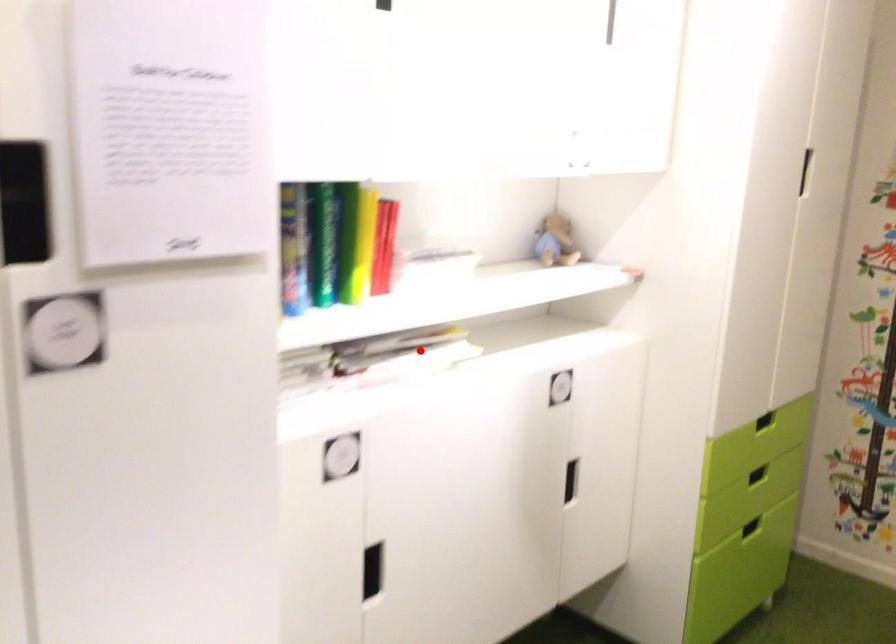
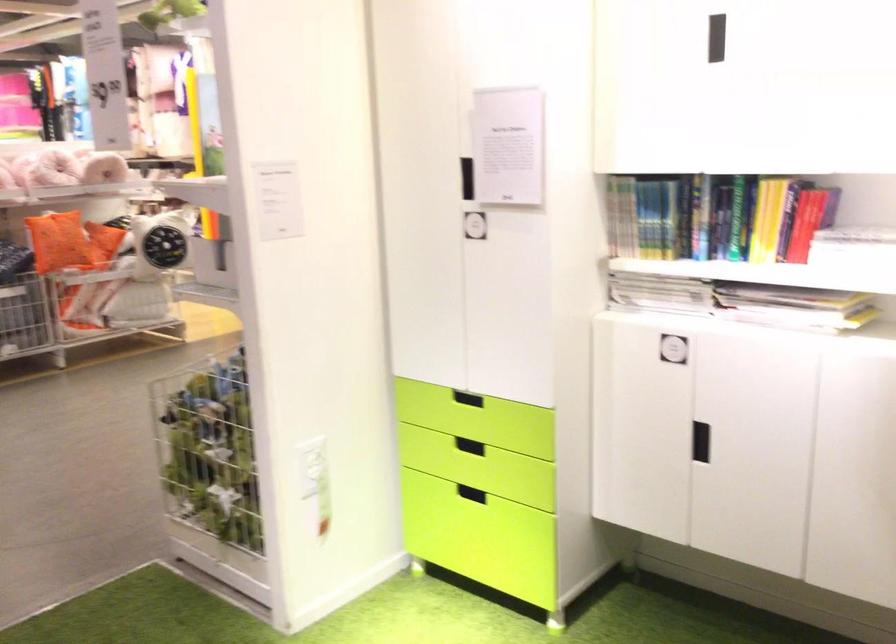
Where in the second image is the point corresponding to the highlighted location from the first image?

(794, 307)